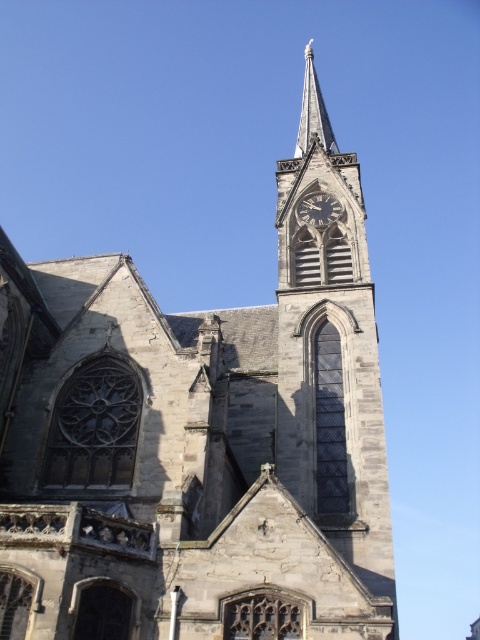
Question: Is gray stone spire at upper center above dark gray stone clock at center?

Choices:
 (A) no
 (B) yes

Answer: (B)

Question: Is gray stone spire at upper center closer to camera compared to dark gray stone clock at center?

Choices:
 (A) no
 (B) yes

Answer: (A)

Question: Which object is farther from the camera taking this photo?

Choices:
 (A) gray stone spire at upper center
 (B) dark gray stone clock at center

Answer: (A)

Question: Where is gray stone spire at upper center located in relation to dark gray stone clock at center in the image?

Choices:
 (A) below
 (B) above

Answer: (B)

Question: Among these points, which one is nearest to the camera?

Choices:
 (A) (305, 77)
 (B) (314, 202)

Answer: (B)